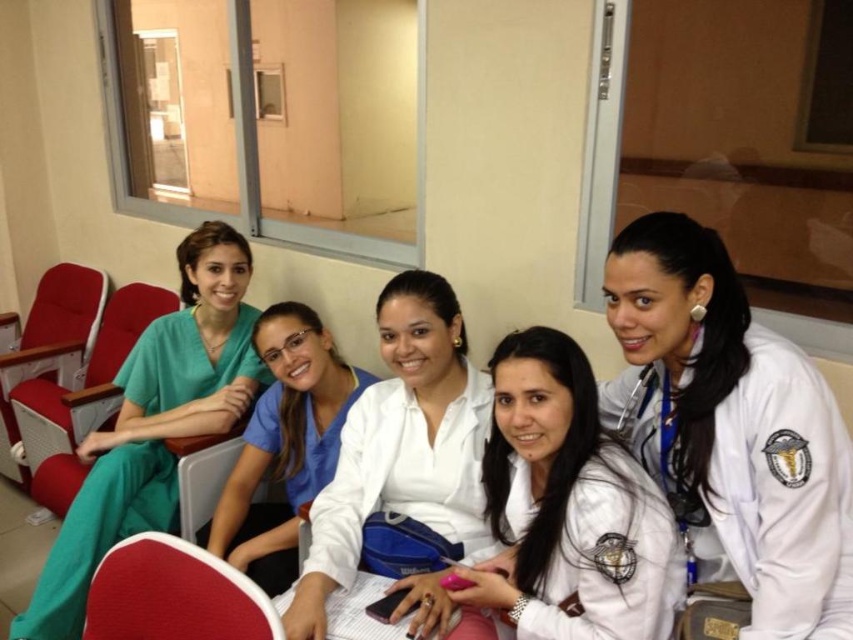
Question: Which point is closer to the camera?

Choices:
 (A) white matte uniform at center
 (B) green fabric chair at left

Answer: (A)

Question: Estimate the real-world distances between objects in this image. Which object is closer to the white smooth lab coat at center?

Choices:
 (A) white matte shirt at center
 (B) green fabric chair at left

Answer: (A)

Question: From the image, what is the correct spatial relationship of blue scrubs at center in relation to green fabric chair at left?

Choices:
 (A) above
 (B) below

Answer: (B)

Question: Where is white matte uniform at center located in relation to blue scrubs at center in the image?

Choices:
 (A) below
 (B) above

Answer: (B)

Question: Can you confirm if white smooth lab coat at center is wider than green fabric chair at left?

Choices:
 (A) no
 (B) yes

Answer: (A)

Question: Estimate the real-world distances between objects in this image. Which object is closer to the white smooth lab coat at center?

Choices:
 (A) blue scrubs at center
 (B) white matte shirt at center

Answer: (B)